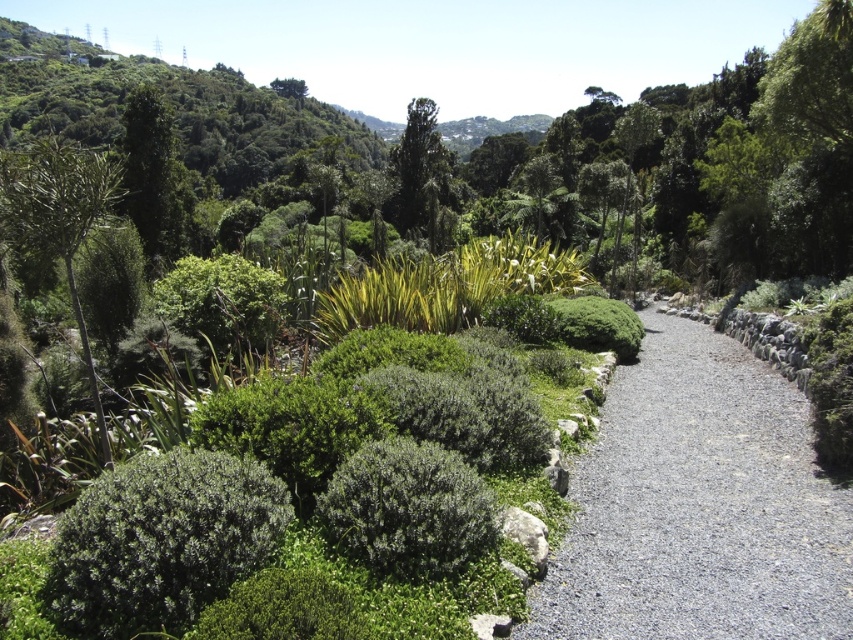
Question: Is gray gravel path at center bigger than green leafy tree at center?

Choices:
 (A) no
 (B) yes

Answer: (A)

Question: Which object appears closest to the camera in this image?

Choices:
 (A) gray gravel path at center
 (B) green leafy tree at center

Answer: (A)

Question: Can you confirm if gray gravel path at center is bigger than green leafy tree at center?

Choices:
 (A) no
 (B) yes

Answer: (A)

Question: Among these points, which one is nearest to the camera?

Choices:
 (A) (404, 204)
 (B) (646, 401)

Answer: (B)

Question: Is gray gravel path at center positioned at the back of green leafy tree at center?

Choices:
 (A) no
 (B) yes

Answer: (A)

Question: Among these objects, which one is nearest to the camera?

Choices:
 (A) green leafy tree at center
 (B) gray gravel path at center

Answer: (B)